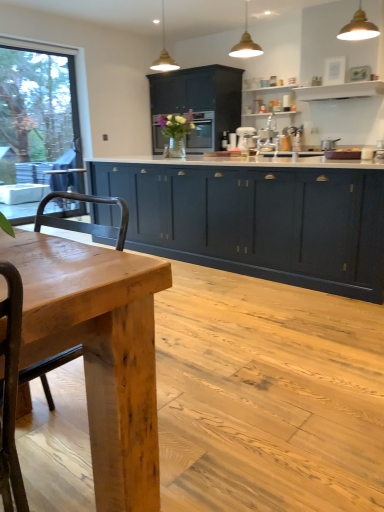
Question: Is metallic gold pendant light at upper center, acting as the first light fixture starting from the front, to the left of transparent glass window at left from the viewer's perspective?

Choices:
 (A) yes
 (B) no

Answer: (B)

Question: Is metallic gold pendant light at upper center, marked as the 3th light fixture in a back-to-front arrangement, taller than transparent glass window at left?

Choices:
 (A) yes
 (B) no

Answer: (B)

Question: Is metallic gold pendant light at upper center, the 3th light fixture positioned from the left, placed right next to transparent glass window at left?

Choices:
 (A) no
 (B) yes

Answer: (A)

Question: Considering the relative sizes of metallic gold pendant light at upper center, the 1th light fixture positioned from the right, and transparent glass window at left in the image provided, is metallic gold pendant light at upper center, the 1th light fixture positioned from the right, smaller than transparent glass window at left?

Choices:
 (A) yes
 (B) no

Answer: (A)

Question: Considering the relative sizes of metallic gold pendant light at upper center, the 3th light fixture positioned from the left, and transparent glass window at left in the image provided, is metallic gold pendant light at upper center, the 3th light fixture positioned from the left, shorter than transparent glass window at left?

Choices:
 (A) yes
 (B) no

Answer: (A)

Question: Choose the correct answer: Is matte dark blue cabinets at center, the second cabinetry in the back-to-front sequence, inside natural wood table at center or outside it?

Choices:
 (A) inside
 (B) outside

Answer: (B)

Question: Considering their positions, is matte dark blue cabinets at center, the first cabinetry when ordered from bottom to top, located in front of or behind natural wood table at center?

Choices:
 (A) behind
 (B) front

Answer: (A)

Question: From a real-world perspective, is matte dark blue cabinets at center, which appears as the second cabinetry when viewed from the top, positioned above or below natural wood table at center?

Choices:
 (A) below
 (B) above

Answer: (A)

Question: From the image's perspective, is matte dark blue cabinets at center, the second cabinetry in the back-to-front sequence, positioned above or below natural wood table at center?

Choices:
 (A) below
 (B) above

Answer: (B)

Question: Looking at the image, does matte gold pendant light at upper center, the second light fixture positioned from the front, seem bigger or smaller compared to matte black oven at center?

Choices:
 (A) small
 (B) big

Answer: (A)

Question: From the image's perspective, is matte gold pendant light at upper center, which is the second light fixture from left to right, positioned above or below matte black oven at center?

Choices:
 (A) above
 (B) below

Answer: (A)

Question: Considering the positions of matte gold pendant light at upper center, which is the second light fixture from left to right, and matte black oven at center in the image, is matte gold pendant light at upper center, which is the second light fixture from left to right, wider or thinner than matte black oven at center?

Choices:
 (A) wide
 (B) thin

Answer: (B)

Question: Is matte gold pendant light at upper center, which is the second light fixture from left to right, taller or shorter than matte black oven at center?

Choices:
 (A) tall
 (B) short

Answer: (B)

Question: From the image's perspective, relative to gold metallic pendant light at upper center, arranged as the first light fixture when viewed from the back, is metallic gold pendant light at upper center, the 1th light fixture positioned from the right, above or below?

Choices:
 (A) above
 (B) below

Answer: (B)

Question: Is metallic gold pendant light at upper center, acting as the first light fixture starting from the front, bigger or smaller than gold metallic pendant light at upper center, the 1th light fixture positioned from the left?

Choices:
 (A) big
 (B) small

Answer: (B)